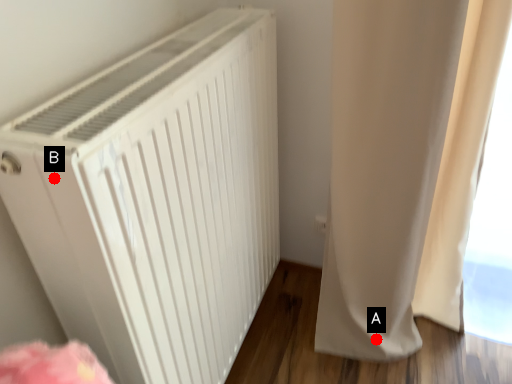
Question: Two points are circled on the image, labeled by A and B beside each circle. Among these points, which one is farthest from the camera?

Choices:
 (A) A is further
 (B) B is further

Answer: (A)